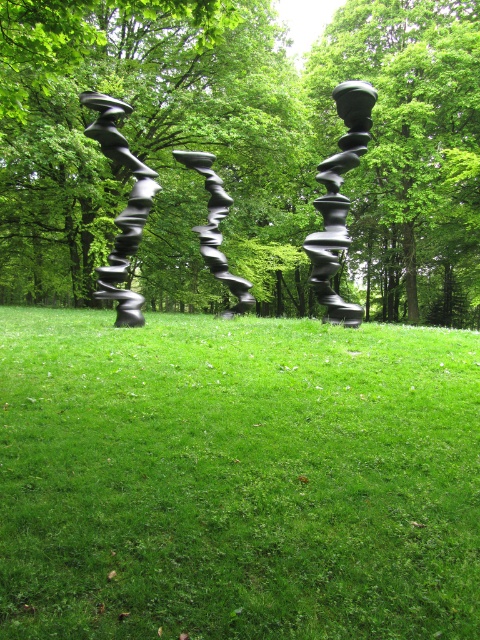
Is polished black spiral at left to the right of satin black sculpture at center from the viewer's perspective?

In fact, polished black spiral at left is to the left of satin black sculpture at center.

In the scene shown: Between polished black spiral at left and satin black sculpture at center, which one appears on the right side from the viewer's perspective?

Positioned to the right is satin black sculpture at center.

Who is more forward, (107, 298) or (208, 220)?

Point (107, 298) is more forward.

This screenshot has height=640, width=480. I want to click on polished black spiral at left, so coord(122,209).

Can you confirm if polished black sculpture at center is positioned to the left of satin black sculpture at center?

No, polished black sculpture at center is not to the left of satin black sculpture at center.

Is polished black sculpture at center thinner than satin black sculpture at center?

No.

Which is in front, point (322, 243) or point (195, 152)?

Point (322, 243) is more forward.

Find the location of `polished black sculpture at center`. polished black sculpture at center is located at coordinates (338, 198).

Is green grass at center wider than green leafy tree at center?

In fact, green grass at center might be narrower than green leafy tree at center.

Is point (441, 531) less distant than point (64, 54)?

That is True.

Is point (245, 458) positioned in front of point (298, 125)?

Yes, point (245, 458) is in front of point (298, 125).

At what (x,y) coordinates should I click in order to perform the action: click on green grass at center. Please return your answer as a coordinate pair (x, y). This screenshot has height=640, width=480. Looking at the image, I should click on (236, 477).